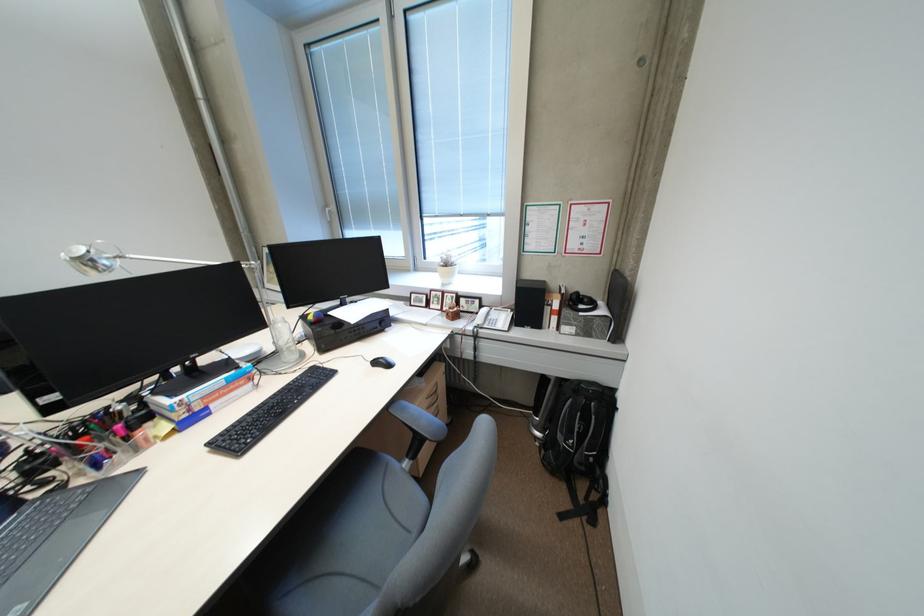
Find where to mov the black computer mouse. Please return your answer as a coordinate pair (x, y).

(382, 362)